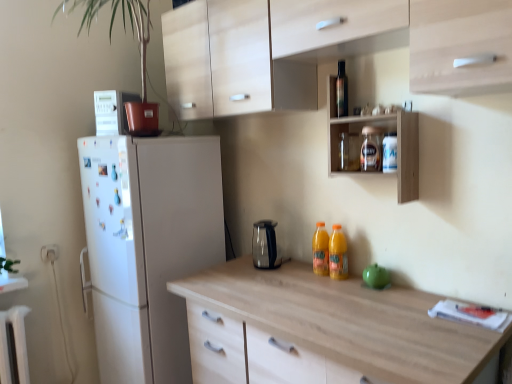
This screenshot has width=512, height=384. Find the location of `green matte apple at center, positioned as the 1th appliance in bottom-to-top order`. green matte apple at center, positioned as the 1th appliance in bottom-to-top order is located at coordinates (376, 276).

The height and width of the screenshot is (384, 512). What do you see at coordinates (376, 276) in the screenshot? I see `green matte apple at center, which is the third appliance in back-to-front order` at bounding box center [376, 276].

This screenshot has width=512, height=384. What do you see at coordinates (342, 90) in the screenshot? I see `shiny dark glass bottle at upper center, the 4th bottle when ordered from bottom to top` at bounding box center [342, 90].

This screenshot has height=384, width=512. What do you see at coordinates (384, 132) in the screenshot? I see `wooden shelf at upper center` at bounding box center [384, 132].

Locate an element on the screen. The width and height of the screenshot is (512, 384). white plastic electric outlet at lower left is located at coordinates (49, 253).

Is green matte apple at center, positioned as the 1th appliance in bottom-to-top order, at the back of white plastic microwave at upper left, which is the third appliance from right to left?

No, white plastic microwave at upper left, which is the third appliance from right to left,'s orientation is not away from green matte apple at center, positioned as the 1th appliance in bottom-to-top order.

This screenshot has height=384, width=512. I want to click on appliance that is the 2nd object located above the green matte apple at center, which appears as the first appliance when viewed from the front (from the image's perspective), so click(x=112, y=111).

Based on the photo, what's the angular difference between white plastic microwave at upper left, placed as the 1th appliance when sorted from back to front, and green matte apple at center, which appears as the first appliance when viewed from the front,'s facing directions?

They differ by 24.2 degrees in their facing directions.

From the image's perspective, which is above, white plastic microwave at upper left, placed as the first appliance when sorted from left to right, or green matte apple at center, positioned as the first appliance in right-to-left order?

white plastic microwave at upper left, placed as the first appliance when sorted from left to right, from the image's perspective.

How different are the orientations of white plastic microwave at upper left, placed as the 1th appliance when sorted from back to front, and green matte plant at upper left in degrees?

There is a 24.2-degree angle between the facing directions of white plastic microwave at upper left, placed as the 1th appliance when sorted from back to front, and green matte plant at upper left.

Between white plastic microwave at upper left, the 3th appliance when ordered from bottom to top, and green matte plant at upper left, which one has more height?

With more height is green matte plant at upper left.

Does white plastic microwave at upper left, the 3th appliance when ordered from bottom to top, have a lesser width compared to green matte plant at upper left?

Correct, the width of white plastic microwave at upper left, the 3th appliance when ordered from bottom to top, is less than that of green matte plant at upper left.

Is green matte plant at upper left completely or partially inside white plastic microwave at upper left, placed as the first appliance when sorted from left to right?

Actually, green matte plant at upper left is outside white plastic microwave at upper left, placed as the first appliance when sorted from left to right.

Is orange plastic bottles at center, marked as the fourth bottle in a top-to-bottom arrangement, positioned far away from white plastic electric outlet at lower left?

Yes, orange plastic bottles at center, marked as the fourth bottle in a top-to-bottom arrangement, and white plastic electric outlet at lower left are located far from each other.

Based on the photo, from a real-world perspective, between orange plastic bottles at center, marked as the fourth bottle in a top-to-bottom arrangement, and white plastic electric outlet at lower left, who is vertically lower?

white plastic electric outlet at lower left is physically lower.

Considering the relative positions of orange plastic bottles at center, acting as the 1th bottle starting from the bottom, and white plastic electric outlet at lower left in the image provided, is orange plastic bottles at center, acting as the 1th bottle starting from the bottom, to the left of white plastic electric outlet at lower left from the viewer's perspective?

In fact, orange plastic bottles at center, acting as the 1th bottle starting from the bottom, is to the right of white plastic electric outlet at lower left.

Is orange plastic bottles at center, marked as the fourth bottle in a top-to-bottom arrangement, taller than white plastic electric outlet at lower left?

Yes, orange plastic bottles at center, marked as the fourth bottle in a top-to-bottom arrangement, is taller than white plastic electric outlet at lower left.

From a real-world perspective, is wooden shelf at upper center positioned above or below white plastic electric outlet at lower left?

In terms of real-world spatial position, wooden shelf at upper center is above white plastic electric outlet at lower left.

Does wooden shelf at upper center have a lesser height compared to white plastic electric outlet at lower left?

No, wooden shelf at upper center is not shorter than white plastic electric outlet at lower left.

Is wooden shelf at upper center next to white plastic electric outlet at lower left?

No, wooden shelf at upper center is not beside white plastic electric outlet at lower left.

How many degrees apart are the facing directions of wooden shelf at upper center and white plastic electric outlet at lower left?

wooden shelf at upper center and white plastic electric outlet at lower left are facing 89.2 degrees away from each other.

From a real-world perspective, between white plastic microwave at upper left, placed as the 1th appliance when sorted from back to front, and sleek metallic kettle at center, placed as the 2th appliance when sorted from top to bottom, who is vertically lower?

From a 3D spatial view, sleek metallic kettle at center, placed as the 2th appliance when sorted from top to bottom, is below.

Is white plastic microwave at upper left, which ranks as the first appliance in top-to-bottom order, positioned far away from sleek metallic kettle at center, the second appliance in the left-to-right sequence?

No.

Does white plastic microwave at upper left, which is the 3th appliance from front to back, have a lesser height compared to sleek metallic kettle at center, the 2th appliance from the back?

No, white plastic microwave at upper left, which is the 3th appliance from front to back, is not shorter than sleek metallic kettle at center, the 2th appliance from the back.

Between white plastic microwave at upper left, placed as the 1th appliance when sorted from back to front, and sleek metallic kettle at center, the 2th appliance positioned from the front, which one has larger width?

white plastic microwave at upper left, placed as the 1th appliance when sorted from back to front, is wider.

Is orange plastic bottles at center, marked as the fourth bottle in a top-to-bottom arrangement, bigger or smaller than green matte apple at center, which is the third appliance in back-to-front order?

orange plastic bottles at center, marked as the fourth bottle in a top-to-bottom arrangement, is bigger than green matte apple at center, which is the third appliance in back-to-front order.

From a real-world perspective, is orange plastic bottles at center, marked as the fourth bottle in a top-to-bottom arrangement, physically below green matte apple at center, positioned as the third appliance in top-to-bottom order?

No, from a real-world perspective, orange plastic bottles at center, marked as the fourth bottle in a top-to-bottom arrangement, is not below green matte apple at center, positioned as the third appliance in top-to-bottom order.

Is orange plastic bottles at center, acting as the 1th bottle starting from the bottom, turned away from green matte apple at center, which is the third appliance in back-to-front order?

orange plastic bottles at center, acting as the 1th bottle starting from the bottom, does not have its back to green matte apple at center, which is the third appliance in back-to-front order.

Between orange plastic bottles at center, acting as the 1th bottle starting from the bottom, and green matte apple at center, positioned as the first appliance in right-to-left order, which one has smaller width?

green matte apple at center, positioned as the first appliance in right-to-left order.

Would you say white plastic microwave at upper left, which is the 3th appliance from front to back, is outside transparent glass jar at upper center, the 2th bottle in the top-to-bottom sequence?

Yes.

From the image's perspective, which is above, white plastic microwave at upper left, which ranks as the first appliance in top-to-bottom order, or transparent glass jar at upper center, the third bottle positioned from the bottom?

white plastic microwave at upper left, which ranks as the first appliance in top-to-bottom order.

Is white plastic microwave at upper left, which is the 3th appliance from front to back, touching transparent glass jar at upper center, the 2th bottle in the top-to-bottom sequence?

No, white plastic microwave at upper left, which is the 3th appliance from front to back, is not touching transparent glass jar at upper center, the 2th bottle in the top-to-bottom sequence.

From the picture: Is the position of white plastic microwave at upper left, placed as the 1th appliance when sorted from back to front, less distant than that of transparent glass jar at upper center, the third bottle positioned from the bottom?

No, white plastic microwave at upper left, placed as the 1th appliance when sorted from back to front, is further to the viewer.

Identify the location of appliance that is the 2nd object located below the white plastic microwave at upper left, the 3th appliance when ordered from bottom to top (from the image's perspective). The width and height of the screenshot is (512, 384). (376, 276).

Image resolution: width=512 pixels, height=384 pixels. I want to click on plant above the white plastic microwave at upper left, placed as the first appliance when sorted from left to right (from the image's perspective), so click(124, 29).

When comparing their distances from transparent glass jar at upper center, the 2th bottle in the top-to-bottom sequence, does wooden shelf at upper center or green matte apple at center, positioned as the first appliance in right-to-left order, seem further?

green matte apple at center, positioned as the first appliance in right-to-left order.

Considering their positions, is clear plastic bottle at upper right, the 3th bottle in the top-to-bottom sequence, positioned closer to transparent glass jar at upper center, the 2th bottle in the top-to-bottom sequence, than shiny dark glass bottle at upper center, the 4th bottle when ordered from bottom to top?

clear plastic bottle at upper right, the 3th bottle in the top-to-bottom sequence.

Considering their positions, is shiny dark glass bottle at upper center, placed as the first bottle when sorted from top to bottom, positioned closer to transparent glass jar at upper center, the third bottle positioned from the bottom, than white plastic electric outlet at lower left?

Based on the image, shiny dark glass bottle at upper center, placed as the first bottle when sorted from top to bottom, appears to be nearer to transparent glass jar at upper center, the third bottle positioned from the bottom.

From the image, which object appears to be nearer to green matte apple at center, positioned as the first appliance in right-to-left order, white plastic electric outlet at lower left or green matte plant at upper left?

Among the two, white plastic electric outlet at lower left is located nearer to green matte apple at center, positioned as the first appliance in right-to-left order.

Estimate the real-world distances between objects in this image. Which object is closer to orange plastic bottles at center, acting as the 1th bottle starting from the bottom, green matte plant at upper left or transparent glass jar at upper center, the third bottle positioned from the bottom?

Among the two, transparent glass jar at upper center, the third bottle positioned from the bottom, is located nearer to orange plastic bottles at center, acting as the 1th bottle starting from the bottom.

When comparing their distances from green matte plant at upper left, does white plastic microwave at upper left, placed as the first appliance when sorted from left to right, or shiny dark glass bottle at upper center, placed as the first bottle when sorted from top to bottom, seem further?

The object further to green matte plant at upper left is shiny dark glass bottle at upper center, placed as the first bottle when sorted from top to bottom.

Considering their positions, is green matte apple at center, placed as the third appliance when sorted from left to right, positioned further to orange plastic bottles at center, acting as the 1th bottle starting from the bottom, than white plastic microwave at upper left, placed as the first appliance when sorted from left to right?

white plastic microwave at upper left, placed as the first appliance when sorted from left to right.

Estimate the real-world distances between objects in this image. Which object is further from white plastic electric outlet at lower left, clear plastic bottle at upper right, the 3th bottle in the top-to-bottom sequence, or transparent glass jar at upper center, the third bottle positioned from the bottom?

clear plastic bottle at upper right, the 3th bottle in the top-to-bottom sequence, is further to white plastic electric outlet at lower left.

The image size is (512, 384). In order to click on appliance between white plastic microwave at upper left, which ranks as the first appliance in top-to-bottom order, and orange plastic bottles at center, acting as the 1th bottle starting from the bottom, from left to right in this screenshot , I will do `click(265, 245)`.

Locate an element on the screen. bottle positioned between wooden shelf at upper center and transparent glass jar at upper center, the third bottle positioned from the bottom, from near to far is located at coordinates (389, 153).

Where is `plant located between white plastic electric outlet at lower left and clear plastic bottle at upper right, the 3th bottle in the top-to-bottom sequence, in the left-right direction`? This screenshot has height=384, width=512. plant located between white plastic electric outlet at lower left and clear plastic bottle at upper right, the 3th bottle in the top-to-bottom sequence, in the left-right direction is located at coordinates (124, 29).

Identify the location of shelf situated between white plastic microwave at upper left, placed as the first appliance when sorted from left to right, and clear plastic bottle at upper right, the 3th bottle in the top-to-bottom sequence, from left to right. This screenshot has width=512, height=384. (384, 132).